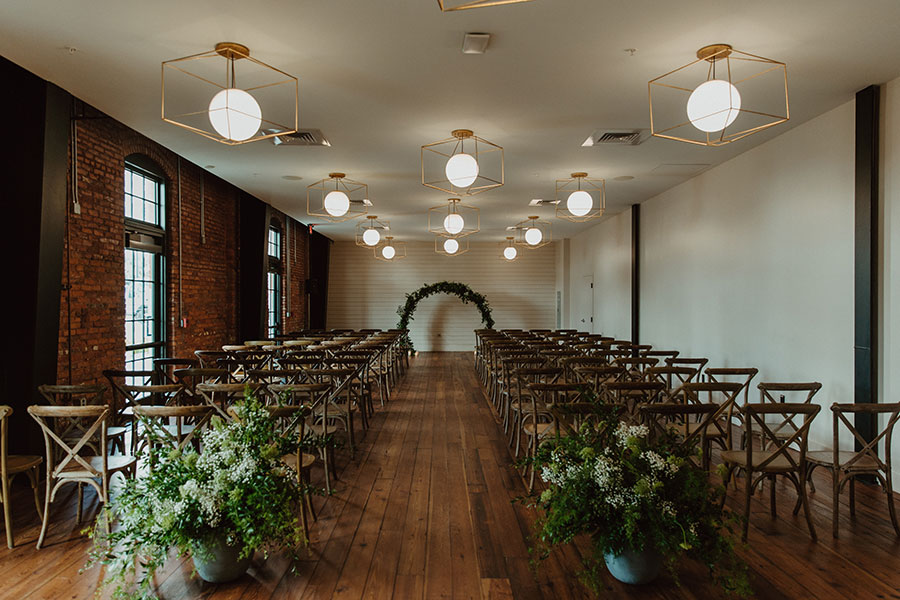
Locate an element on the screen. Image resolution: width=900 pixels, height=600 pixels. wooden floor is located at coordinates (803, 569).